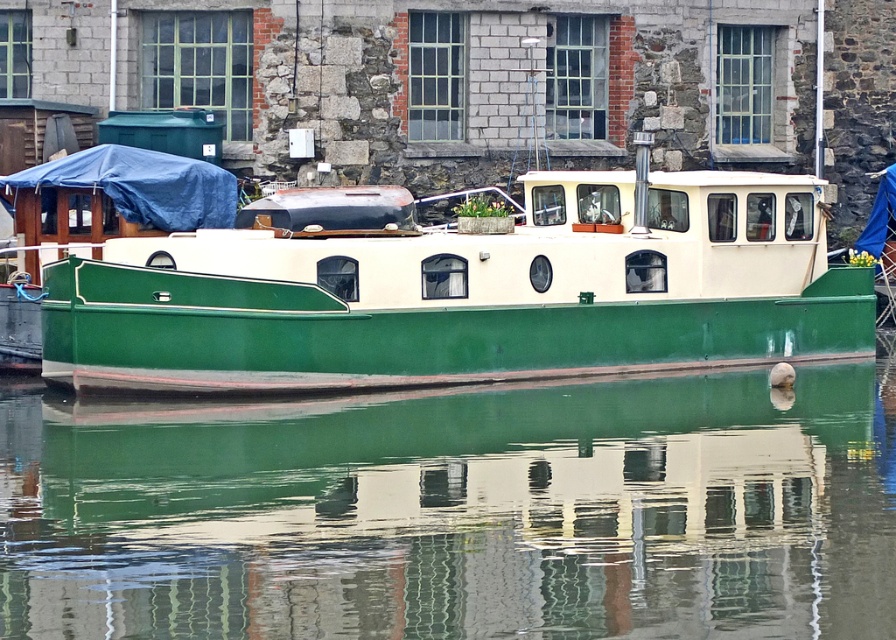
Is green smooth water at center closer to the viewer compared to green matte boat at center?

That is True.

Does green smooth water at center have a greater height compared to green matte boat at center?

Correct, green smooth water at center is much taller as green matte boat at center.

I want to click on green smooth water at center, so click(x=459, y=513).

The height and width of the screenshot is (640, 896). In order to click on green smooth water at center in this screenshot , I will do `click(459, 513)`.